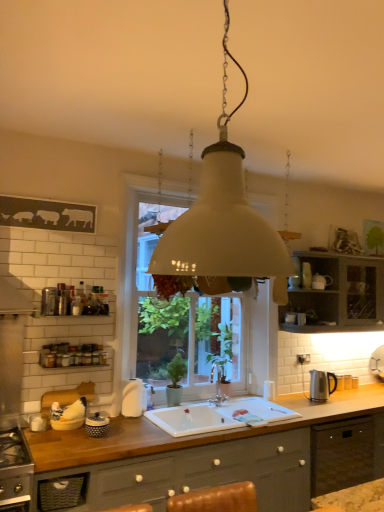
Question: From a real-world perspective, does polka dot ceramic jar at lower left, the first appliance in the front-to-back sequence, stand above white glass window at center?

Choices:
 (A) no
 (B) yes

Answer: (A)

Question: Is polka dot ceramic jar at lower left, the first appliance viewed from the left, facing towards white glass window at center?

Choices:
 (A) no
 (B) yes

Answer: (A)

Question: Is polka dot ceramic jar at lower left, the first appliance in the front-to-back sequence, at the left side of white glass window at center?

Choices:
 (A) yes
 (B) no

Answer: (A)

Question: Considering the relative sizes of polka dot ceramic jar at lower left, the first appliance viewed from the left, and white glass window at center in the image provided, is polka dot ceramic jar at lower left, the first appliance viewed from the left, thinner than white glass window at center?

Choices:
 (A) no
 (B) yes

Answer: (B)

Question: Considering the relative sizes of polka dot ceramic jar at lower left, the first appliance in the front-to-back sequence, and white glass window at center in the image provided, is polka dot ceramic jar at lower left, the first appliance in the front-to-back sequence, bigger than white glass window at center?

Choices:
 (A) no
 (B) yes

Answer: (A)

Question: Would you say wooden at lower center is to the left or to the right of silver metallic faucet at sink center in the picture?

Choices:
 (A) left
 (B) right

Answer: (A)

Question: Considering their positions, is wooden at lower center located in front of or behind silver metallic faucet at sink center?

Choices:
 (A) front
 (B) behind

Answer: (A)

Question: Considering the positions of wooden at lower center and silver metallic faucet at sink center in the image, is wooden at lower center wider or thinner than silver metallic faucet at sink center?

Choices:
 (A) wide
 (B) thin

Answer: (A)

Question: Considering the positions of point (153, 446) and point (223, 394), is point (153, 446) closer or farther from the camera than point (223, 394)?

Choices:
 (A) farther
 (B) closer

Answer: (B)

Question: From a real-world perspective, is matte gray cabinet at upper right physically located above or below white matte pendant light at center?

Choices:
 (A) below
 (B) above

Answer: (A)

Question: From their relative heights in the image, would you say matte gray cabinet at upper right is taller or shorter than white matte pendant light at center?

Choices:
 (A) tall
 (B) short

Answer: (B)

Question: Based on their positions, is matte gray cabinet at upper right located to the left or right of white matte pendant light at center?

Choices:
 (A) left
 (B) right

Answer: (B)

Question: From the image's perspective, is matte gray cabinet at upper right positioned above or below white matte pendant light at center?

Choices:
 (A) above
 (B) below

Answer: (B)

Question: In terms of size, does wooden at lower center appear bigger or smaller than white matte soap dispenser at center, placed as the 2th appliance when sorted from left to right?

Choices:
 (A) small
 (B) big

Answer: (B)

Question: From a real-world perspective, is wooden at lower center physically located above or below white matte soap dispenser at center, the second appliance positioned from the front?

Choices:
 (A) above
 (B) below

Answer: (B)